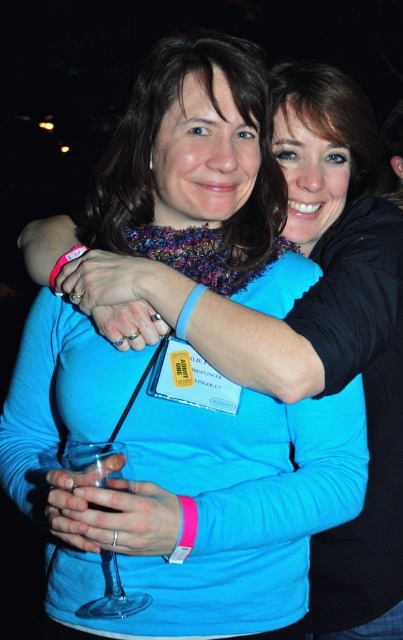
You are at a party and want to place a napkin under the transparent glass wine glass at lower left. Since the matte black hair at upper center is above it, will the napkin fit without touching the hair?

The transparent glass wine glass at lower left is located below the matte black hair at upper center, so placing a napkin under the wine glass will not interfere with the matte black hair at upper center.

You are a photographer at a party and want to take a closeup photo of the knitted scarf at center and the transparent glass wine glass at lower left. Which object should you focus on first to ensure both are in focus?

The knitted scarf at center is further to the viewer than the transparent glass wine glass at lower left, so you should focus on the knitted scarf at center first to ensure both are in focus.

You are standing in a crowded room and holding a transparent glass wine glass at lower left. A person approaches you from the front. If they extend their hand to take the glass, will they be able to reach it without moving closer?

The transparent glass wine glass at lower left and viewer are 87.55 centimeters apart. Since the person is approaching from the front and needs to reach 87.55 centimeters, they might need to move closer as typical arm reach is about 70 cm. Therefore, they cannot reach it without moving closer.